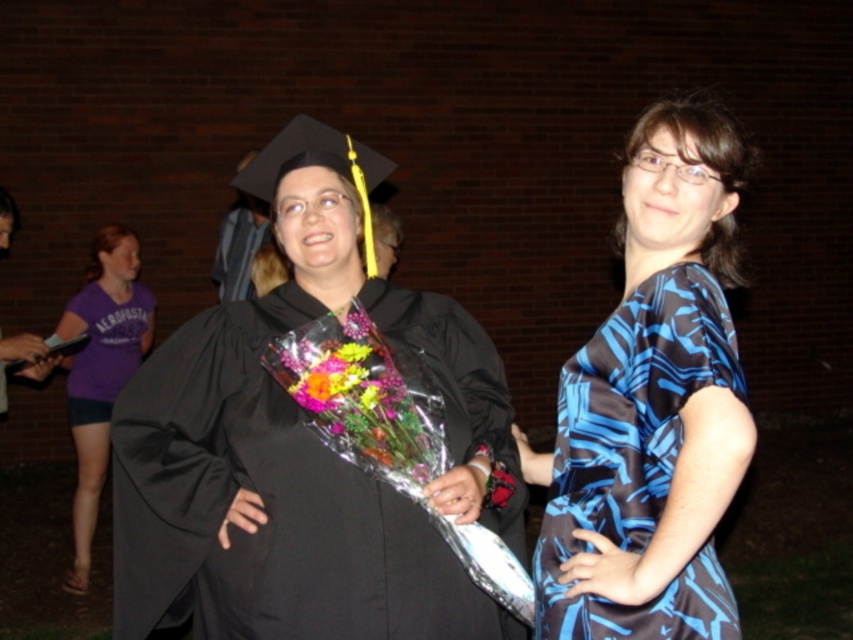
Which of these two, blue printed dress at center or matte black graduation cap at upper center, stands taller?

blue printed dress at center is taller.

This screenshot has width=853, height=640. Find the location of `blue printed dress at center`. blue printed dress at center is located at coordinates (653, 404).

Where is `blue printed dress at center`? The image size is (853, 640). blue printed dress at center is located at coordinates (653, 404).

Consider the image. Does translucent plastic bouquet at center have a larger size compared to matte black graduation cap at upper center?

Incorrect, translucent plastic bouquet at center is not larger than matte black graduation cap at upper center.

From the picture: Who is more forward, (357, 344) or (227, 298)?

Point (357, 344)

The height and width of the screenshot is (640, 853). Find the location of `translucent plastic bouquet at center`. translucent plastic bouquet at center is located at coordinates (351, 388).

Is purple cotton t-shirt at left thinner than purple cotton t-shirt at lower left?

Incorrect, purple cotton t-shirt at left's width is not less than purple cotton t-shirt at lower left's.

Can you confirm if purple cotton t-shirt at left is bigger than purple cotton t-shirt at lower left?

Correct, purple cotton t-shirt at left is larger in size than purple cotton t-shirt at lower left.

Locate an element on the screen. The width and height of the screenshot is (853, 640). purple cotton t-shirt at left is located at coordinates (102, 371).